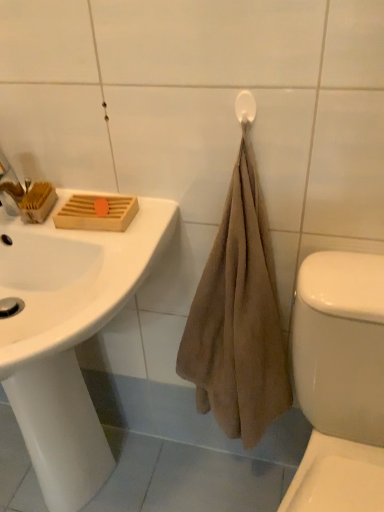
Question: Should I look upward or downward to see white glossy sink at upper left?

Choices:
 (A) down
 (B) up

Answer: (A)

Question: Is white glossy sink at upper left surrounded by white plastic towel bar at upper right?

Choices:
 (A) yes
 (B) no

Answer: (B)

Question: Is white plastic towel bar at upper right wider than white glossy sink at upper left?

Choices:
 (A) yes
 (B) no

Answer: (B)

Question: From the image's perspective, is white plastic towel bar at upper right above white glossy sink at upper left?

Choices:
 (A) yes
 (B) no

Answer: (A)

Question: Can you confirm if white plastic towel bar at upper right is taller than white glossy sink at upper left?

Choices:
 (A) no
 (B) yes

Answer: (A)

Question: From a real-world perspective, is white plastic towel bar at upper right below white glossy sink at upper left?

Choices:
 (A) no
 (B) yes

Answer: (A)

Question: Is white plastic towel bar at upper right positioned in front of white glossy sink at upper left?

Choices:
 (A) no
 (B) yes

Answer: (A)

Question: Is white glossy toilet at lower right looking in the opposite direction of white plastic towel bar at upper right?

Choices:
 (A) yes
 (B) no

Answer: (B)

Question: Can you confirm if white glossy toilet at lower right is thinner than white plastic towel bar at upper right?

Choices:
 (A) yes
 (B) no

Answer: (B)

Question: Does white glossy toilet at lower right have a lesser height compared to white plastic towel bar at upper right?

Choices:
 (A) no
 (B) yes

Answer: (A)

Question: Does white glossy toilet at lower right turn towards white plastic towel bar at upper right?

Choices:
 (A) yes
 (B) no

Answer: (B)

Question: Is white glossy toilet at lower right beside white plastic towel bar at upper right?

Choices:
 (A) no
 (B) yes

Answer: (A)

Question: From the image's perspective, would you say white glossy toilet at lower right is positioned over white plastic towel bar at upper right?

Choices:
 (A) no
 (B) yes

Answer: (A)

Question: Are white plastic towel bar at upper right and white glossy toilet at lower right beside each other?

Choices:
 (A) yes
 (B) no

Answer: (B)